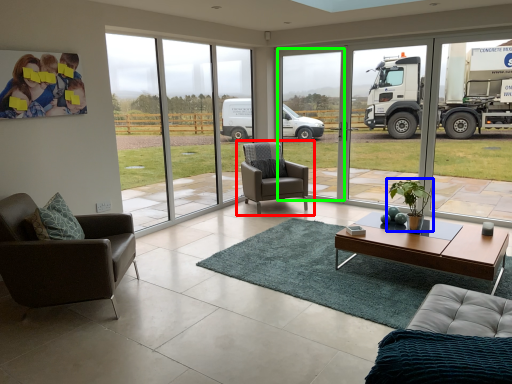
Question: Which is nearer to the chair (highlighted by a red box)? houseplant (highlighted by a blue box) or window frame (highlighted by a green box).

Choices:
 (A) houseplant
 (B) window frame

Answer: (A)